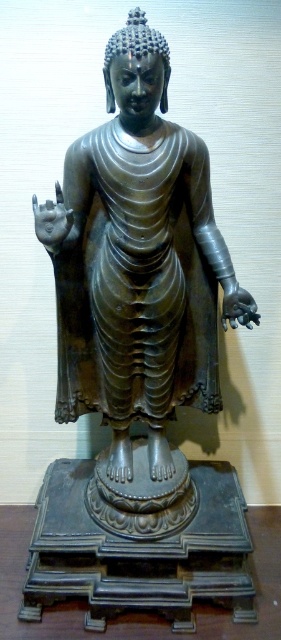
Is polished bronze statue at center bigger than polished dark wood table at center?

Yes, polished bronze statue at center is bigger than polished dark wood table at center.

Is polished bronze statue at center above polished dark wood table at center?

Yes.

This screenshot has width=281, height=640. What are the coordinates of `polished bronze statue at center` in the screenshot? It's located at (137, 77).

Image resolution: width=281 pixels, height=640 pixels. I want to click on polished bronze statue at center, so click(137, 77).